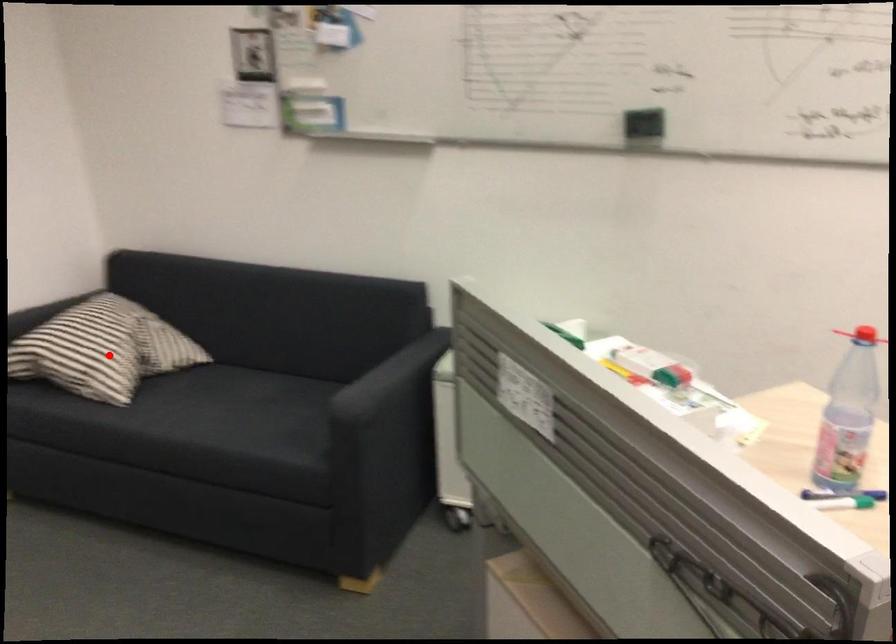
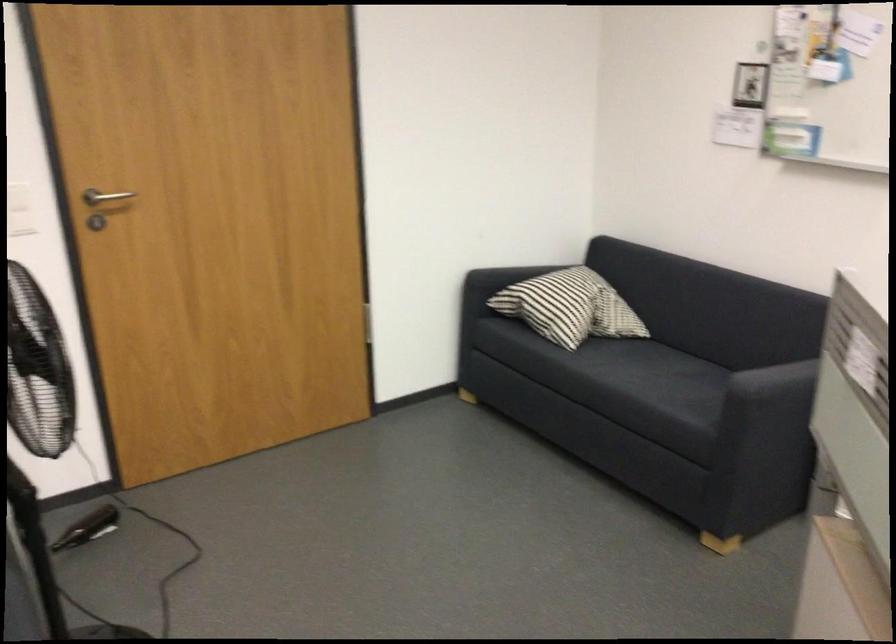
Question: I am providing you with two images of the same scene from different viewpoints. Given a red point in image1, look at the same physical point in image2. Is it:

Choices:
 (A) Closer to the viewpoint
 (B) Farther from the viewpoint

Answer: (B)